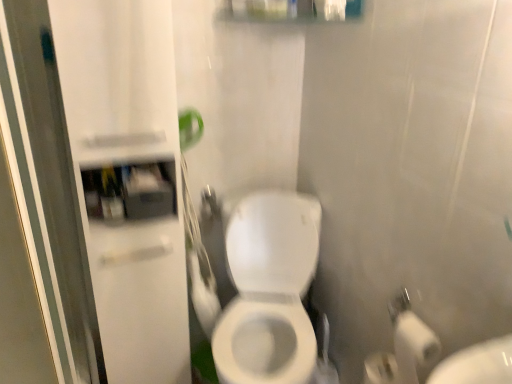
How much space does transparent glass screen door at left, which is counted as the second screen door, starting from the right, occupy vertically?

transparent glass screen door at left, which is counted as the second screen door, starting from the right, is 4.37 feet tall.

This screenshot has height=384, width=512. What do you see at coordinates (128, 179) in the screenshot?
I see `white glossy cabinet at left, arranged as the first screen door when viewed from the right` at bounding box center [128, 179].

What do you see at coordinates (269, 291) in the screenshot? The image size is (512, 384). I see `white glossy toilet at center` at bounding box center [269, 291].

Image resolution: width=512 pixels, height=384 pixels. What do you see at coordinates (130, 191) in the screenshot? I see `matte plastic medicine cabinet at upper left` at bounding box center [130, 191].

This screenshot has width=512, height=384. What are the coordinates of `transparent glass screen door at left, arranged as the 1th screen door when viewed from the left` in the screenshot? It's located at (49, 169).

Is matte plastic medicine cabinet at upper left to the left of white glossy cabinet at left, the 2th screen door positioned from the left, from the viewer's perspective?

No.

Can you tell me how much matte plastic medicine cabinet at upper left and white glossy cabinet at left, arranged as the first screen door when viewed from the right, differ in facing direction?

There is a 0.000198-degree angle between the facing directions of matte plastic medicine cabinet at upper left and white glossy cabinet at left, arranged as the first screen door when viewed from the right.

The width and height of the screenshot is (512, 384). Find the location of `medicine cabinet that appears above the white glossy cabinet at left, arranged as the first screen door when viewed from the right (from the image's perspective)`. medicine cabinet that appears above the white glossy cabinet at left, arranged as the first screen door when viewed from the right (from the image's perspective) is located at coordinates (x=130, y=191).

Considering the relative sizes of matte plastic medicine cabinet at upper left and white glossy cabinet at left, arranged as the first screen door when viewed from the right, in the image provided, is matte plastic medicine cabinet at upper left shorter than white glossy cabinet at left, arranged as the first screen door when viewed from the right,?

Yes.

Is transparent glass screen door at left, arranged as the 1th screen door when viewed from the left, not near matte plastic medicine cabinet at upper left?

transparent glass screen door at left, arranged as the 1th screen door when viewed from the left, is actually quite close to matte plastic medicine cabinet at upper left.

Does transparent glass screen door at left, arranged as the 1th screen door when viewed from the left, have a lesser width compared to matte plastic medicine cabinet at upper left?

No.

Considering the sizes of objects transparent glass screen door at left, arranged as the 1th screen door when viewed from the left, and matte plastic medicine cabinet at upper left in the image provided, who is smaller, transparent glass screen door at left, arranged as the 1th screen door when viewed from the left, or matte plastic medicine cabinet at upper left?

Smaller between the two is matte plastic medicine cabinet at upper left.

Is white glossy toilet at center positioned behind transparent glass screen door at left, which is counted as the second screen door, starting from the right?

Yes, white glossy toilet at center is further from the viewer.

Is transparent glass screen door at left, which is counted as the second screen door, starting from the right, at the back of white glossy toilet at center?

No, white glossy toilet at center is not facing away from transparent glass screen door at left, which is counted as the second screen door, starting from the right.

Is white glossy toilet at center bigger than transparent glass screen door at left, which is counted as the second screen door, starting from the right?

Yes.

Are matte plastic medicine cabinet at upper left and white glossy toilet at center beside each other?

matte plastic medicine cabinet at upper left and white glossy toilet at center are not in contact.

From the image's perspective, which one is positioned lower, matte plastic medicine cabinet at upper left or white glossy toilet at center?

white glossy toilet at center is shown below in the image.

In the scene shown: Considering their positions, is transparent glass screen door at left, arranged as the 1th screen door when viewed from the left, located in front of or behind white glossy toilet at center?

Visually, transparent glass screen door at left, arranged as the 1th screen door when viewed from the left, is located in front of white glossy toilet at center.

Is transparent glass screen door at left, which is counted as the second screen door, starting from the right, next to white glossy toilet at center?

No, transparent glass screen door at left, which is counted as the second screen door, starting from the right, is not next to white glossy toilet at center.

Image resolution: width=512 pixels, height=384 pixels. I want to click on toilet behind the transparent glass screen door at left, arranged as the 1th screen door when viewed from the left, so point(269,291).

Is transparent glass screen door at left, which is counted as the second screen door, starting from the right, at the left side of white glossy toilet at center?

Yes, transparent glass screen door at left, which is counted as the second screen door, starting from the right, is to the left of white glossy toilet at center.

Could you tell me if white glossy toilet at center is facing matte plastic medicine cabinet at upper left?

No, white glossy toilet at center is not aimed at matte plastic medicine cabinet at upper left.

Is white glossy toilet at center inside the boundaries of matte plastic medicine cabinet at upper left, or outside?

The correct answer is: outside.

Would you say white glossy toilet at center is a long distance from matte plastic medicine cabinet at upper left?

No, white glossy toilet at center is not far from matte plastic medicine cabinet at upper left.

Which of these two, matte plastic medicine cabinet at upper left or transparent glass screen door at left, arranged as the 1th screen door when viewed from the left, is bigger?

Bigger between the two is transparent glass screen door at left, arranged as the 1th screen door when viewed from the left.

Is matte plastic medicine cabinet at upper left beside transparent glass screen door at left, which is counted as the second screen door, starting from the right?

No, matte plastic medicine cabinet at upper left is not making contact with transparent glass screen door at left, which is counted as the second screen door, starting from the right.

Can you tell me how much matte plastic medicine cabinet at upper left and transparent glass screen door at left, arranged as the 1th screen door when viewed from the left, differ in facing direction?

matte plastic medicine cabinet at upper left and transparent glass screen door at left, arranged as the 1th screen door when viewed from the left, are facing 0.000318 degrees away from each other.

Which is nearer, (103, 186) or (15, 17)?

Clearly, point (103, 186) is more distant from the camera than point (15, 17).

Locate an element on the screen. The width and height of the screenshot is (512, 384). medicine cabinet above the white glossy cabinet at left, arranged as the first screen door when viewed from the right (from the image's perspective) is located at coordinates (130, 191).

What are the coordinates of `the 2nd screen door below the matte plastic medicine cabinet at upper left (from the image's perspective)` in the screenshot? It's located at (49, 169).

Based on their spatial positions, is white glossy cabinet at left, the 2th screen door positioned from the left, or white glossy toilet at center closer to transparent glass screen door at left, which is counted as the second screen door, starting from the right?

white glossy cabinet at left, the 2th screen door positioned from the left, lies closer to transparent glass screen door at left, which is counted as the second screen door, starting from the right, than the other object.

Which object lies nearer to the anchor point white glossy toilet at center, matte plastic medicine cabinet at upper left or transparent glass screen door at left, which is counted as the second screen door, starting from the right?

Based on the image, matte plastic medicine cabinet at upper left appears to be nearer to white glossy toilet at center.

Which object lies nearer to the anchor point transparent glass screen door at left, arranged as the 1th screen door when viewed from the left, white glossy cabinet at left, arranged as the first screen door when viewed from the right, or matte plastic medicine cabinet at upper left?

white glossy cabinet at left, arranged as the first screen door when viewed from the right, is positioned closer to the anchor transparent glass screen door at left, arranged as the 1th screen door when viewed from the left.

When comparing their distances from matte plastic medicine cabinet at upper left, does white glossy toilet at center or transparent glass screen door at left, arranged as the 1th screen door when viewed from the left, seem further?

white glossy toilet at center is positioned further to the anchor matte plastic medicine cabinet at upper left.

Considering their positions, is white glossy toilet at center positioned closer to white glossy cabinet at left, arranged as the first screen door when viewed from the right, than matte plastic medicine cabinet at upper left?

The object closer to white glossy cabinet at left, arranged as the first screen door when viewed from the right, is matte plastic medicine cabinet at upper left.

Which object lies nearer to the anchor point matte plastic medicine cabinet at upper left, transparent glass screen door at left, which is counted as the second screen door, starting from the right, or white glossy cabinet at left, arranged as the first screen door when viewed from the right?

Based on the image, white glossy cabinet at left, arranged as the first screen door when viewed from the right, appears to be nearer to matte plastic medicine cabinet at upper left.

Estimate the real-world distances between objects in this image. Which object is further from transparent glass screen door at left, which is counted as the second screen door, starting from the right, white glossy toilet at center or matte plastic medicine cabinet at upper left?

The object further to transparent glass screen door at left, which is counted as the second screen door, starting from the right, is white glossy toilet at center.

Looking at the image, which one is located closer to white glossy cabinet at left, the 2th screen door positioned from the left, matte plastic medicine cabinet at upper left or transparent glass screen door at left, which is counted as the second screen door, starting from the right?

The object closer to white glossy cabinet at left, the 2th screen door positioned from the left, is matte plastic medicine cabinet at upper left.

Where is `screen door between transparent glass screen door at left, arranged as the 1th screen door when viewed from the left, and white glossy toilet at center, in the horizontal direction`? screen door between transparent glass screen door at left, arranged as the 1th screen door when viewed from the left, and white glossy toilet at center, in the horizontal direction is located at coordinates coord(128,179).

This screenshot has height=384, width=512. What are the coordinates of `screen door between transparent glass screen door at left, arranged as the 1th screen door when viewed from the left, and matte plastic medicine cabinet at upper left, along the z-axis` in the screenshot? It's located at (128, 179).

I want to click on medicine cabinet between white glossy cabinet at left, the 2th screen door positioned from the left, and white glossy toilet at center, so click(x=130, y=191).

Where is `medicine cabinet between transparent glass screen door at left, which is counted as the second screen door, starting from the right, and white glossy toilet at center, in the horizontal direction`? Image resolution: width=512 pixels, height=384 pixels. medicine cabinet between transparent glass screen door at left, which is counted as the second screen door, starting from the right, and white glossy toilet at center, in the horizontal direction is located at coordinates (130, 191).